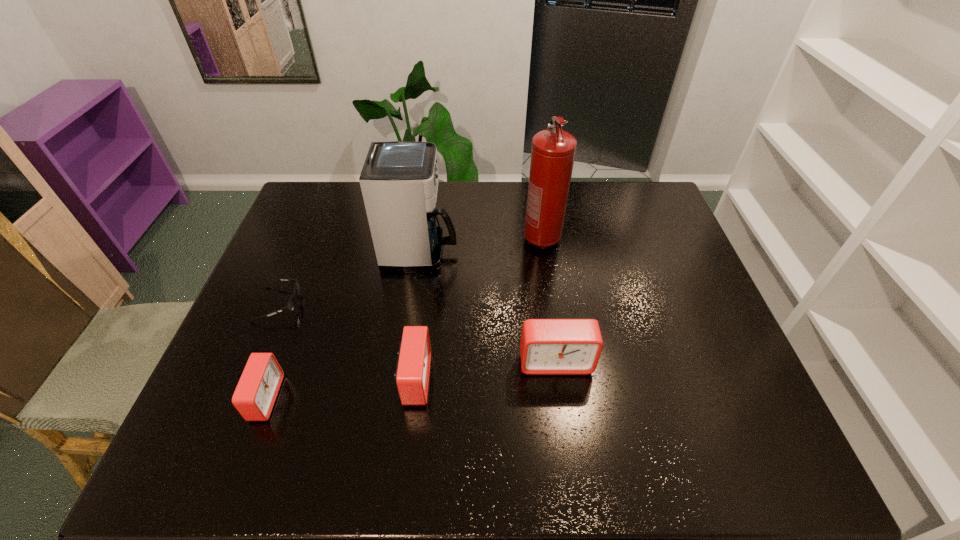
In order to click on the leftmost alarm clock in this screenshot , I will do `click(254, 397)`.

What are the coordinates of `the second shortest object` in the screenshot? It's located at (254, 397).

Identify the location of the second tallest alarm clock. (412, 373).

This screenshot has width=960, height=540. Find the location of `the second alarm clock from left to right`. the second alarm clock from left to right is located at coordinates (412, 373).

Where is `the rightmost alarm clock`? The height and width of the screenshot is (540, 960). the rightmost alarm clock is located at coordinates (548, 346).

What are the coordinates of `the tallest object` in the screenshot? It's located at (553, 151).

Image resolution: width=960 pixels, height=540 pixels. In order to click on coffee maker in this screenshot , I will do `click(399, 181)`.

I want to click on the fourth nearest object, so click(291, 304).

Where is `the shortest object`? The image size is (960, 540). the shortest object is located at coordinates click(x=291, y=304).

Locate an element on the screen. vacant space located 0.190m on the front-facing side of the leftmost alarm clock is located at coordinates (361, 398).